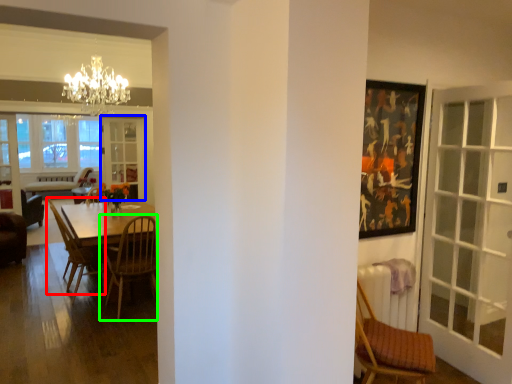
Question: Estimate the real-world distances between objects in this image. Which object is farther from chair (highlighted by a red box), screen door (highlighted by a blue box) or chair (highlighted by a green box)?

Choices:
 (A) screen door
 (B) chair

Answer: (A)